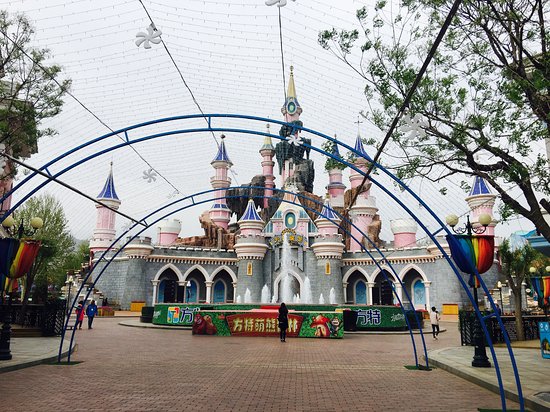
Image resolution: width=550 pixels, height=412 pixels. What are the coordinates of `archways` in the screenshot? It's located at (169, 267), (197, 270), (220, 271), (357, 275), (378, 276), (415, 276).